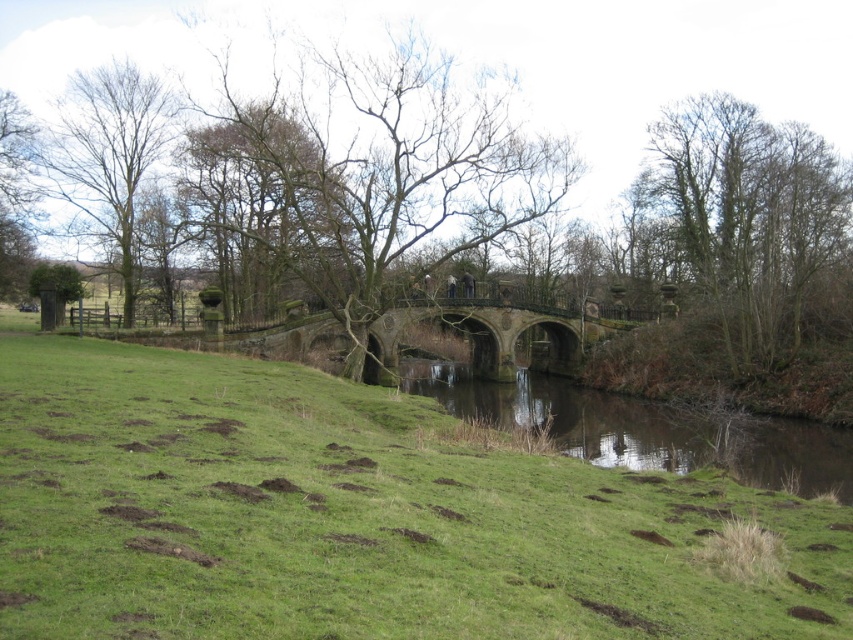
You are standing on the stone bridge and notice a point marked at coordinates (479, 58). What object does this point correspond to?

The point at coordinates (479, 58) corresponds to the brown leafless tree at center.